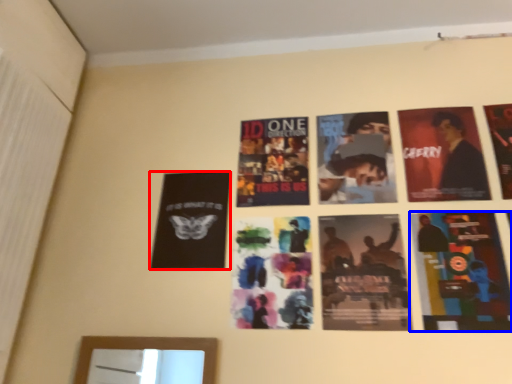
Question: Which object is further to the camera taking this photo, poster (highlighted by a red box) or poster (highlighted by a blue box)?

Choices:
 (A) poster
 (B) poster

Answer: (A)